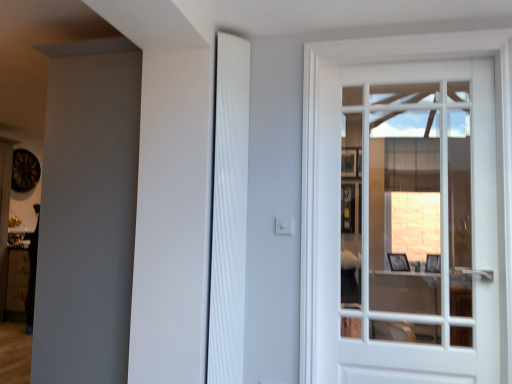
The width and height of the screenshot is (512, 384). Identify the location of white ribbed shutter at center. (228, 211).

Describe the element at coordinates (228, 211) in the screenshot. I see `white ribbed shutter at center` at that location.

The width and height of the screenshot is (512, 384). What do you see at coordinates (405, 224) in the screenshot? I see `white glass door at right` at bounding box center [405, 224].

This screenshot has width=512, height=384. Find the location of `white glass door at right`. white glass door at right is located at coordinates (405, 224).

This screenshot has width=512, height=384. What are the coordinates of `white ribbed shutter at center` in the screenshot? It's located at (228, 211).

Would you say white ribbed shutter at center is to the left or to the right of white glass door at right in the picture?

From the image, it's evident that white ribbed shutter at center is to the left of white glass door at right.

In the scene shown: Which object is closer to the camera, white ribbed shutter at center or white glass door at right?

white glass door at right is more forward.

Which is behind, point (224, 229) or point (334, 321)?

Point (334, 321)

Looking at this image, from the image's perspective, which is above, white ribbed shutter at center or white glass door at right?

white ribbed shutter at center is shown above in the image.

From a real-world perspective, who is located lower, white ribbed shutter at center or white glass door at right?

From a 3D spatial view, white glass door at right is below.

Between white ribbed shutter at center and white glass door at right, which one has smaller width?

Thinner between the two is white ribbed shutter at center.

Between white ribbed shutter at center and white glass door at right, which one has more height?

white ribbed shutter at center.

Is white ribbed shutter at center bigger than white glass door at right?

Actually, white ribbed shutter at center might be smaller than white glass door at right.

Is white glass door at right located within white ribbed shutter at center?

No, white glass door at right is not a part of white ribbed shutter at center.

Is white ribbed shutter at center in contact with white glass door at right?

There is a gap between white ribbed shutter at center and white glass door at right.

Is white ribbed shutter at center looking in the opposite direction of white glass door at right?

No, white ribbed shutter at center is not facing away from white glass door at right.

How distant is white ribbed shutter at center from white glass door at right?

The distance of white ribbed shutter at center from white glass door at right is 3.86 feet.

Where is `shutter lying behind the white glass door at right`? The width and height of the screenshot is (512, 384). shutter lying behind the white glass door at right is located at coordinates (228, 211).

Considering the relative positions of white glass door at right and white ribbed shutter at center in the image provided, is white glass door at right to the left of white ribbed shutter at center from the viewer's perspective?

No, white glass door at right is not to the left of white ribbed shutter at center.

Is the depth of white glass door at right greater than that of white ribbed shutter at center?

No.

Considering the positions of points (489, 108) and (244, 272), is point (489, 108) farther from camera compared to point (244, 272)?

No, (489, 108) is in front of (244, 272).

From the image's perspective, is white glass door at right beneath white ribbed shutter at center?

Indeed, from the image's perspective, white glass door at right is shown beneath white ribbed shutter at center.

From a real-world perspective, is white glass door at right on top of white ribbed shutter at center?

No.

Considering the relative sizes of white glass door at right and white ribbed shutter at center in the image provided, is white glass door at right thinner than white ribbed shutter at center?

Incorrect, the width of white glass door at right is not less than that of white ribbed shutter at center.

Between white glass door at right and white ribbed shutter at center, which one has more height?

white ribbed shutter at center.

Is white glass door at right smaller than white ribbed shutter at center?

No.

From the picture: Do you think white glass door at right is within white ribbed shutter at center, or outside of it?

white glass door at right is located beyond the bounds of white ribbed shutter at center.

Is white glass door at right positioned far away from white ribbed shutter at center?

white glass door at right is far away from white ribbed shutter at center.

Is white glass door at right positioned with its back to white ribbed shutter at center?

No, white glass door at right is not facing away from white ribbed shutter at center.

You are a GUI agent. You are given a task and a screenshot of the screen. Output one action in this format:
    pyautogui.click(x=<x>, y=<y>)
    Task: Click on the shutter lying on the left of white glass door at right
    This screenshot has height=384, width=512.
    Given the screenshot: What is the action you would take?
    tap(228, 211)

Locate an element on the screen. This screenshot has width=512, height=384. shutter behind the white glass door at right is located at coordinates (228, 211).

Identify the location of door on the right of white ribbed shutter at center. (405, 224).